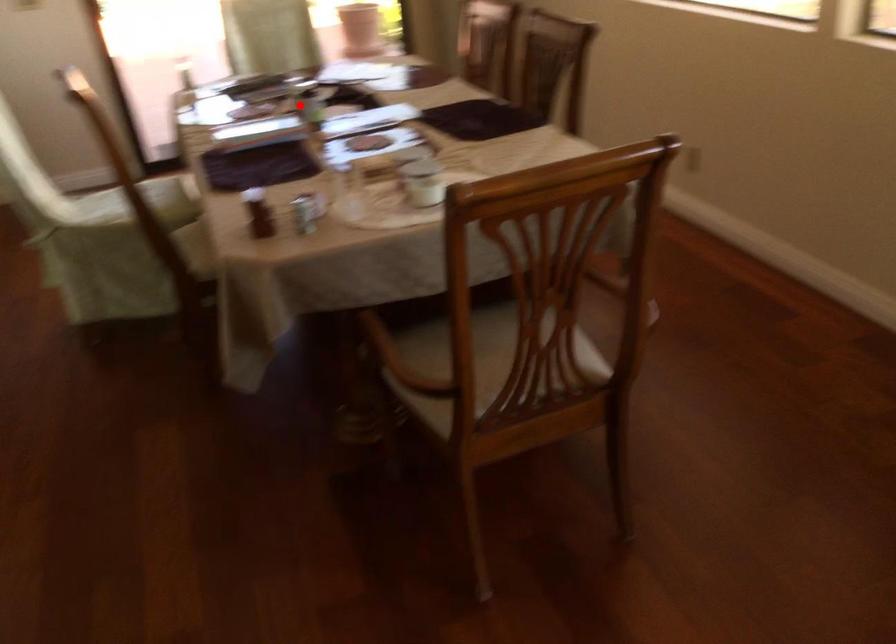
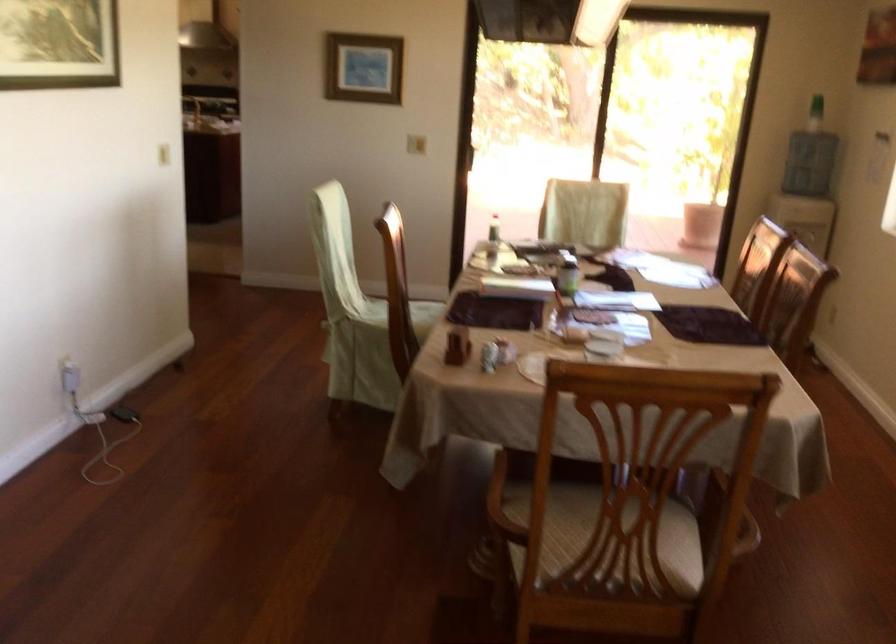
Find the pixel in the second image that matches the highlighted location in the first image.

(566, 272)